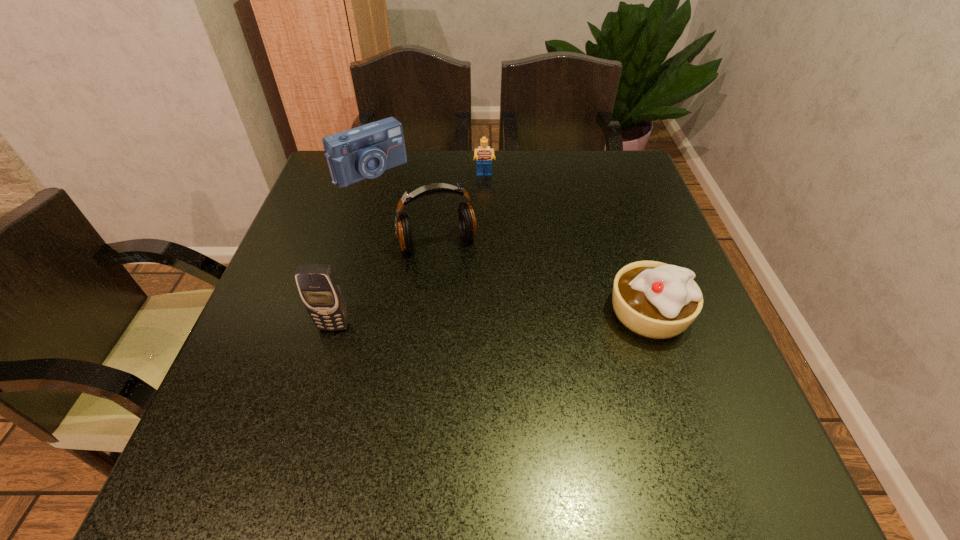
The height and width of the screenshot is (540, 960). In order to click on cellular telephone in this screenshot , I will do `click(320, 290)`.

This screenshot has width=960, height=540. I want to click on whipped cream, so click(653, 299).

Locate an element on the screen. the third farthest object is located at coordinates (467, 221).

Where is `Lego`? The height and width of the screenshot is (540, 960). Lego is located at coordinates (484, 154).

Image resolution: width=960 pixels, height=540 pixels. I want to click on camera, so click(366, 151).

At what (x,y) coordinates should I click in order to perform the action: click on vacant area located 0.080m on the front face of the cellular telephone. Please return your answer as a coordinate pair (x, y). Image resolution: width=960 pixels, height=540 pixels. Looking at the image, I should click on (322, 368).

I want to click on free point located on the back of the rightmost object, so click(x=625, y=244).

You are a GUI agent. You are given a task and a screenshot of the screen. Output one action in this format:
    pyautogui.click(x=<x>, y=<y>)
    Task: Click on the vacant space located 0.310m on the ear cups of the headset
    Image resolution: width=960 pixels, height=540 pixels.
    Given the screenshot: What is the action you would take?
    pyautogui.click(x=488, y=369)

You are a GUI agent. You are given a task and a screenshot of the screen. Output one action in this format:
    pyautogui.click(x=<x>, y=<y>)
    Task: Click on the free space located on the ear cups of the headset
    Image resolution: width=960 pixels, height=540 pixels.
    Given the screenshot: What is the action you would take?
    pyautogui.click(x=468, y=313)

The image size is (960, 540). In order to click on free space located 0.100m on the ear cups of the headset in this screenshot , I will do `click(459, 289)`.